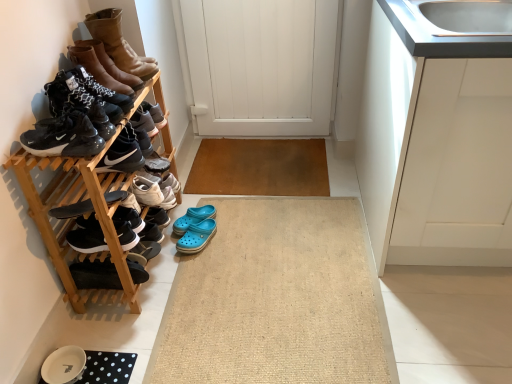
You are a GUI agent. You are given a task and a screenshot of the screen. Output one action in this format:
    pyautogui.click(x=<x>, y=<y>)
    Task: Click on the vacant space underneath beige woven bath mat at center (from a real-world perspective)
    Image resolution: width=512 pixels, height=384 pixels.
    Given the screenshot: What is the action you would take?
    (x=271, y=275)